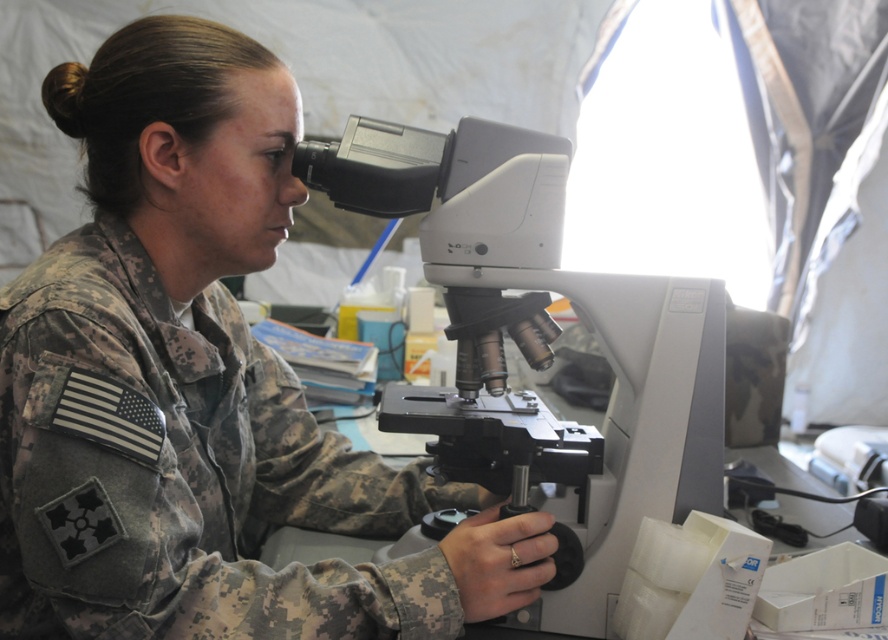
Is camouflage fabric uniform at center to the right of white plastic microscope at center from the viewer's perspective?

No, camouflage fabric uniform at center is not to the right of white plastic microscope at center.

Between camouflage fabric uniform at center and white plastic microscope at center, which one is positioned higher?

white plastic microscope at center is higher up.

What do you see at coordinates (181, 470) in the screenshot?
I see `camouflage fabric uniform at center` at bounding box center [181, 470].

Identify the location of camouflage fabric uniform at center. The width and height of the screenshot is (888, 640). (181, 470).